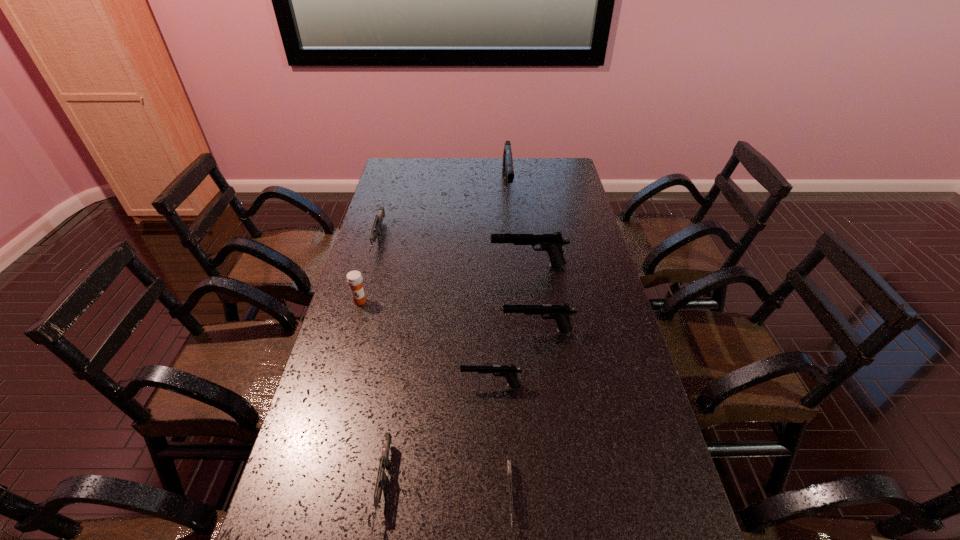
I want to click on the biggest grey gun, so click(377, 225).

The image size is (960, 540). I want to click on the shortest gun, so click(509, 474).

Identify the location of the rightmost grey gun. (509, 474).

Find the location of a particular element. This screenshot has width=960, height=540. free space located 0.180m at the aiming end of the farthest gun is located at coordinates (512, 234).

Find the location of a particular element. The width and height of the screenshot is (960, 540). free space located at the aiming end of the second tallest gun is located at coordinates (457, 265).

Find the location of `free region located at the aiming end of the second tallest gun`. free region located at the aiming end of the second tallest gun is located at coordinates click(x=460, y=265).

At what (x,y) coordinates should I click in order to perform the action: click on free space located at the aiming end of the second tallest gun. Please return your answer as a coordinate pair (x, y). The width and height of the screenshot is (960, 540). Looking at the image, I should click on (440, 265).

At what (x,y) coordinates should I click in order to perform the action: click on vacant region located at the aiming end of the second smallest black gun. Please return your answer as a coordinate pair (x, y). The image size is (960, 540). Looking at the image, I should click on (426, 330).

Where is `free spot located at the aiming end of the second smallest black gun`? free spot located at the aiming end of the second smallest black gun is located at coordinates (420, 330).

Find the location of a particular element. This screenshot has height=540, width=960. free location located 0.080m at the aiming end of the second smallest black gun is located at coordinates pyautogui.click(x=476, y=330).